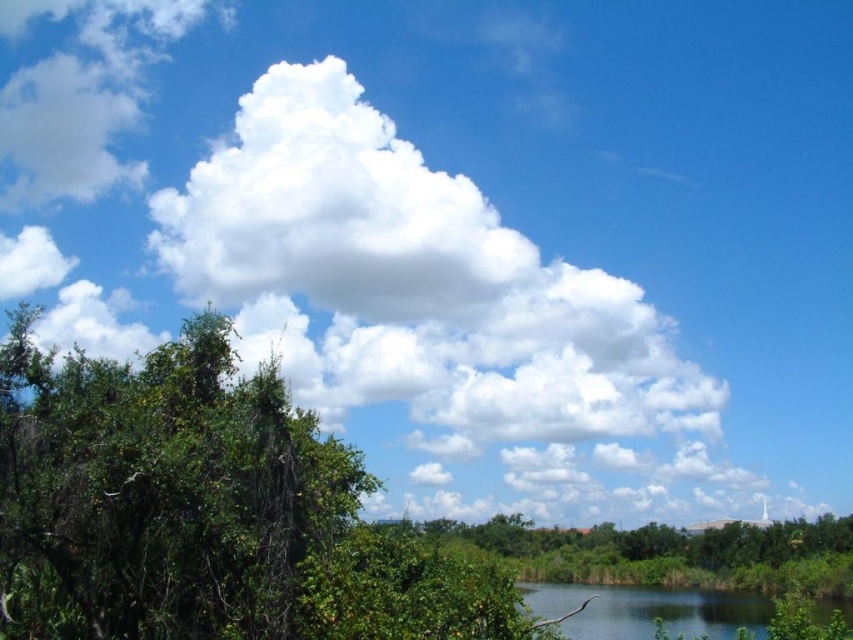
You are planning to set up a small tent in this area. If you want to maximize the space around your tent for activities, which location would be better between the green leafy tree at lower center and the green grassy river at lower right?

The green grassy river at lower right occupies more space than the green leafy tree at lower center, so setting up the tent near the green grassy river at lower right would provide more open space for activities.

You are standing in the middle of the scene and want to take a photo of both the green leafy tree at left and the green leafy tree at lower center. Which tree should you adjust your camera angle upwards to capture in the frame?

You should adjust your camera angle upwards to capture the green leafy tree at left because it is positioned above the green leafy tree at lower center.